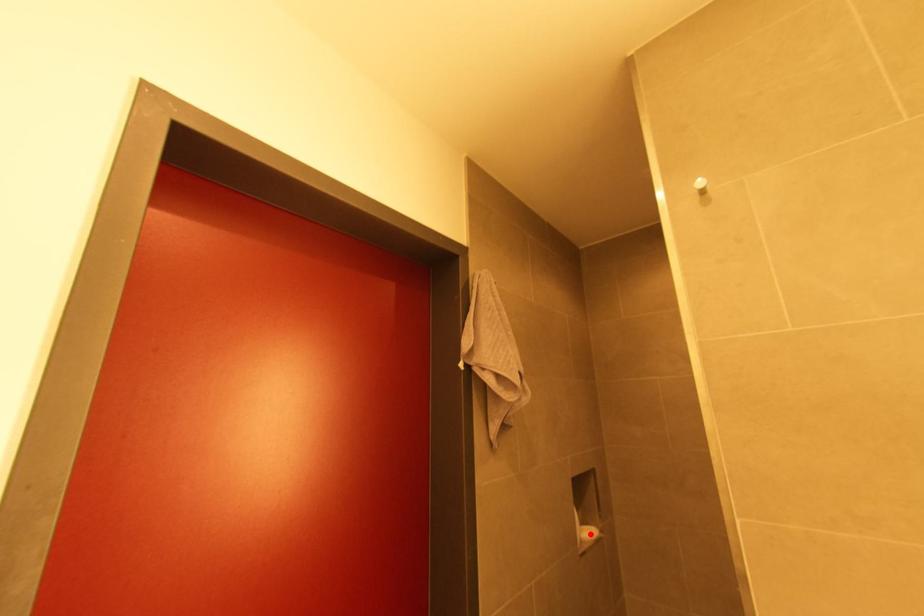
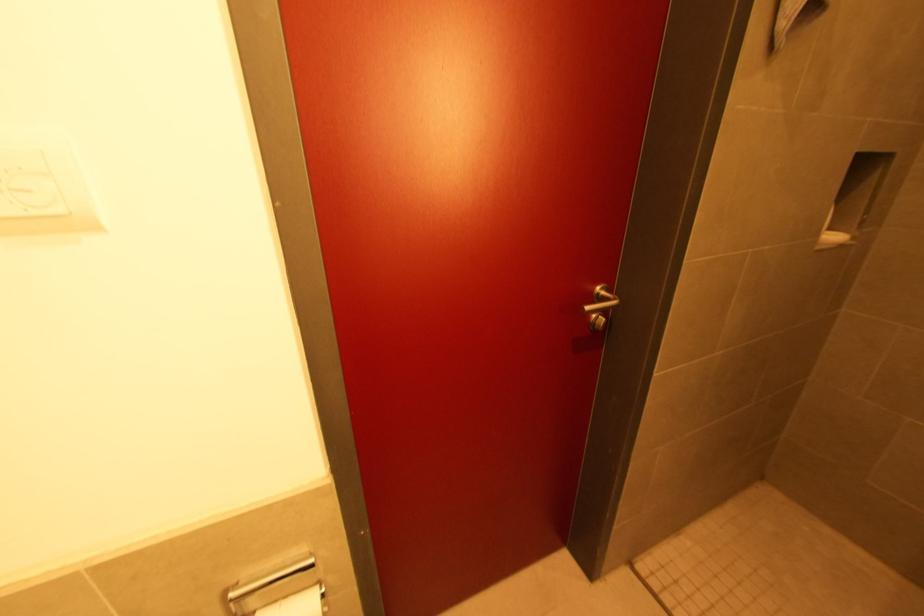
In the second image, find the point that corresponds to the highlighted location in the first image.

(833, 238)